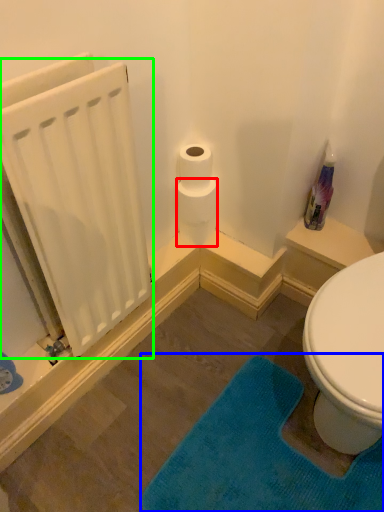
Question: Based on their relative distances, which object is farther from toilet paper (highlighted by a red box)? Choose from bath mat (highlighted by a blue box) and radiator (highlighted by a green box).

Choices:
 (A) bath mat
 (B) radiator

Answer: (A)